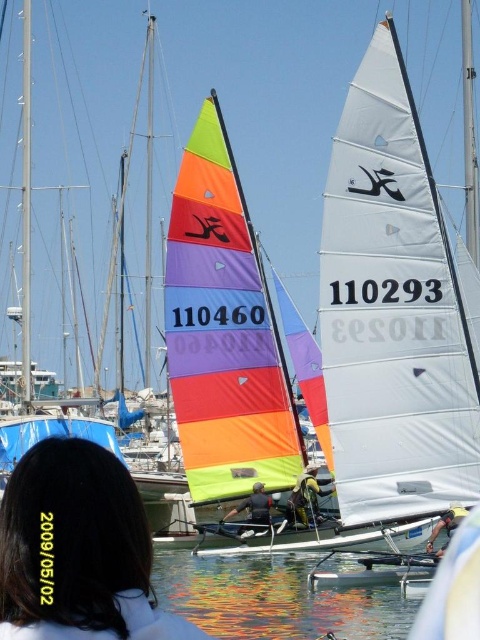
Question: Which point is closer to the camera?

Choices:
 (A) dark brown hair at center
 (B) camouflage fabric jacket at center
 (C) dark blue fabric at center
 (D) reflective water at lower center

Answer: (A)

Question: Can you confirm if dark blue fabric at center is positioned to the left of metallic silver helmet at center?

Choices:
 (A) no
 (B) yes

Answer: (B)

Question: Which point is closer to the camera taking this photo?

Choices:
 (A) (242, 508)
 (B) (289, 513)
 (C) (299, 586)
 (D) (442, 516)

Answer: (D)

Question: Estimate the real-world distances between objects in this image. Which object is closer to the dark brown hair at center?

Choices:
 (A) reflective water at lower center
 (B) dark blue fabric at center
 (C) metallic silver helmet at center

Answer: (A)

Question: Is reflective water at lower center smaller than metallic silver helmet at center?

Choices:
 (A) yes
 (B) no

Answer: (B)

Question: From the image, what is the correct spatial relationship of dark brown hair at center in relation to reflective water at lower center?

Choices:
 (A) right
 (B) left

Answer: (B)